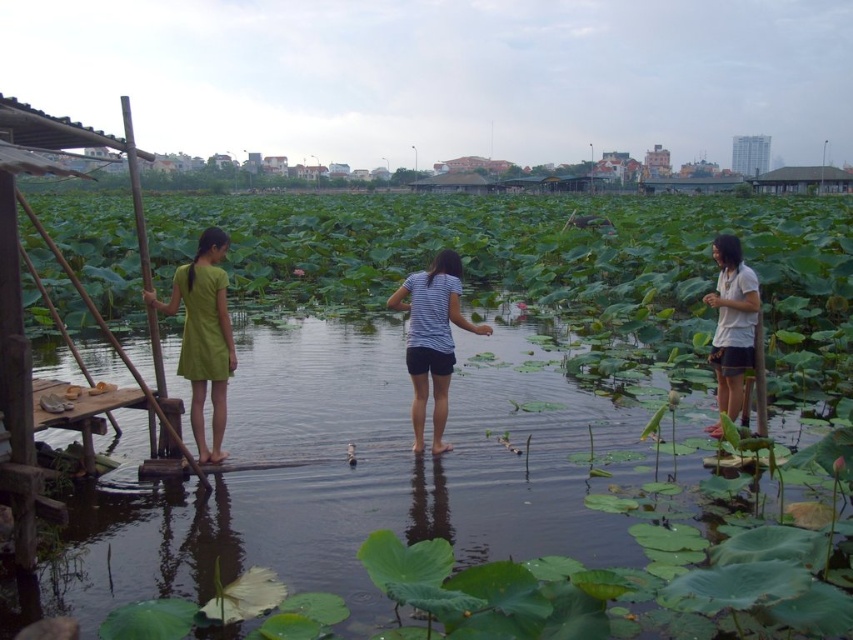
You are a photographer planning to take a photo of the green matte dress at left and the white cotton shirt at right in the serene lotus pond scene. Based on their positions and the description provided, which of the two subjects is positioned higher in the frame?

The green matte dress at left is taller than the white cotton shirt at right, so it is positioned higher in the frame.

You are standing at the wooden dock on the left and want to walk to the person in the striped shirt in the center. Which direction should you move relative to the point at (219, 592) and the point at (189, 272)?

You should move towards the point at (189, 272) since it is behind the point at (219, 592), which is in front of it. The person in the striped shirt is likely near the point at (189, 272).

You are standing at the wooden platform on the left and want to reach the point marked by the coordinates point (462, 524) on the green leafy water at center. Which direction should you move in to get there?

You should move towards the center of the green leafy water at center to reach the point (462, 524) because it is located there.